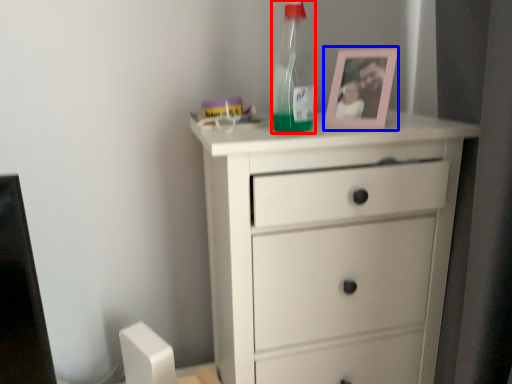
Question: Which object is closer to the camera taking this photo, bottle (highlighted by a red box) or picture frame (highlighted by a blue box)?

Choices:
 (A) bottle
 (B) picture frame

Answer: (A)